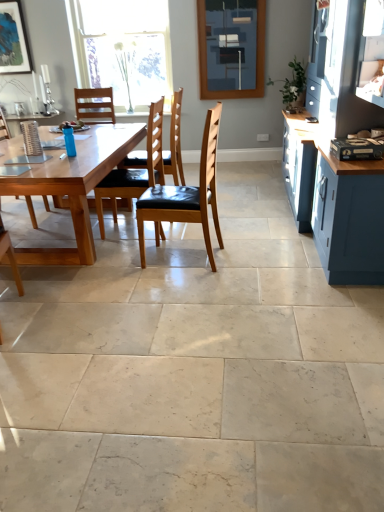
This screenshot has height=512, width=384. Find the location of `free point below brown leather chair at center, placed as the fourth chair when sorted from left to right (from a real-world perspective)`. free point below brown leather chair at center, placed as the fourth chair when sorted from left to right (from a real-world perspective) is located at coordinates (185, 258).